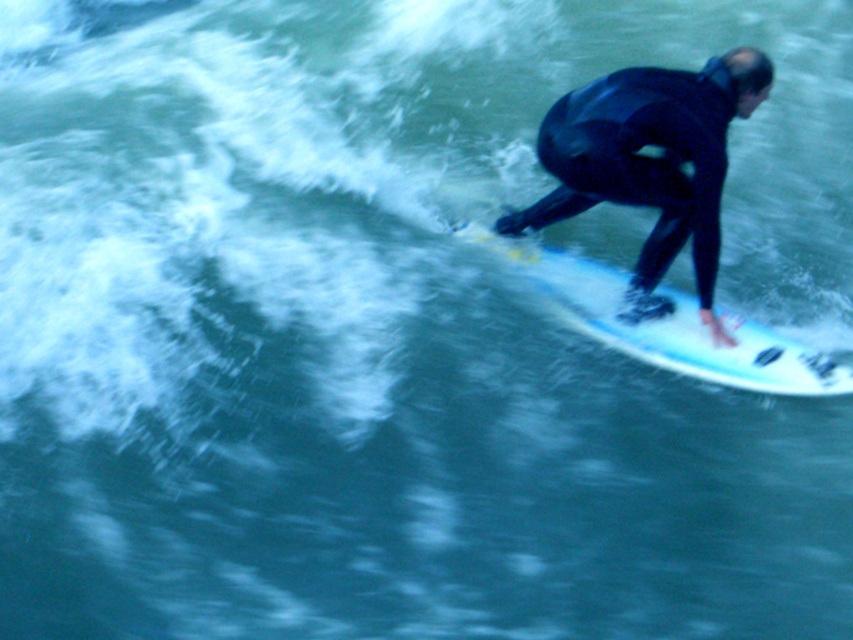
You are a photographer trying to capture the surfer in the image. You want to ensure both the black matte wetsuit at center and the white glossy surfboard at right are clearly visible in your shot. Given their sizes, which object should you focus on first to ensure proper exposure?

The white glossy surfboard at right is larger than the black matte wetsuit at center. To ensure proper exposure, focus on the larger object first, which is the white glossy surfboard at right, as it will require more attention to capture details accurately.

From the picture: You are a photographer trying to capture the surfer in the image. Since you want to focus on the surfer, which object should you adjust your camera focus on first, the black matte wetsuit at center or the white glossy surfboard at right?

The black matte wetsuit at center is in front of the white glossy surfboard at right, so you should focus on the black matte wetsuit at center first to ensure the surfer is sharply captured.

You are a photographer trying to capture the surfer in the image. You need to know which object is narrower between the black matte wetsuit at center and the white glossy surfboard at right to adjust your camera settings. Which one is narrower?

The black matte wetsuit at center is narrower than the white glossy surfboard at right.